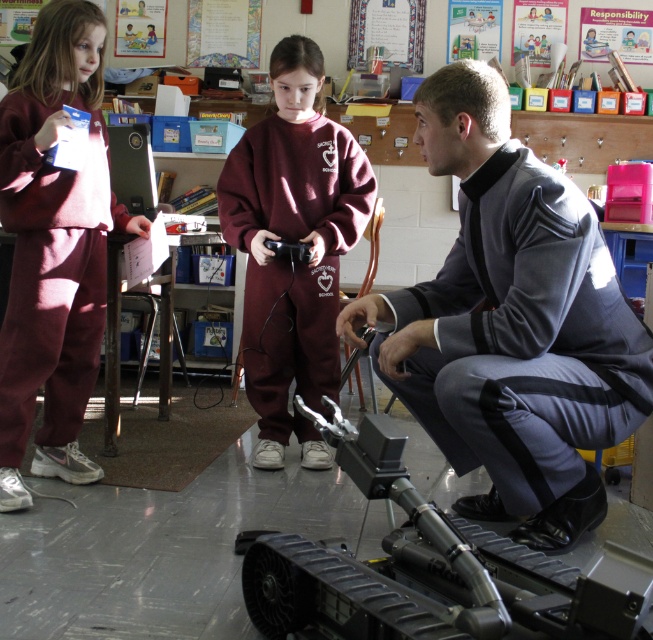
Does point (443, 108) come farther from viewer compared to point (84, 392)?

That is False.

Looking at this image, who is shorter, gray fabric uniform at center or maroon fleece pants at left?

Standing shorter between the two is gray fabric uniform at center.

What do you see at coordinates (511, 323) in the screenshot? I see `gray fabric uniform at center` at bounding box center [511, 323].

Where is `gray fabric uniform at center`? The image size is (653, 640). gray fabric uniform at center is located at coordinates point(511,323).

Locate an element on the screen. maroon fleece pants at left is located at coordinates (54, 248).

In the scene shown: Is maroon fleece pants at left positioned at the back of maroon fleece sweatshirt at center?

No, it is in front of maroon fleece sweatshirt at center.

Describe the element at coordinates (54, 248) in the screenshot. I see `maroon fleece pants at left` at that location.

Where is `maroon fleece pants at left`? maroon fleece pants at left is located at coordinates (54, 248).

Does gray fabric uniform at center have a lesser height compared to maroon fleece sweatshirt at center?

Correct, gray fabric uniform at center is not as tall as maroon fleece sweatshirt at center.

Who is positioned more to the right, gray fabric uniform at center or maroon fleece sweatshirt at center?

Positioned to the right is gray fabric uniform at center.

The width and height of the screenshot is (653, 640). What do you see at coordinates (511, 323) in the screenshot?
I see `gray fabric uniform at center` at bounding box center [511, 323].

Where is `gray fabric uniform at center`? The image size is (653, 640). gray fabric uniform at center is located at coordinates (511, 323).